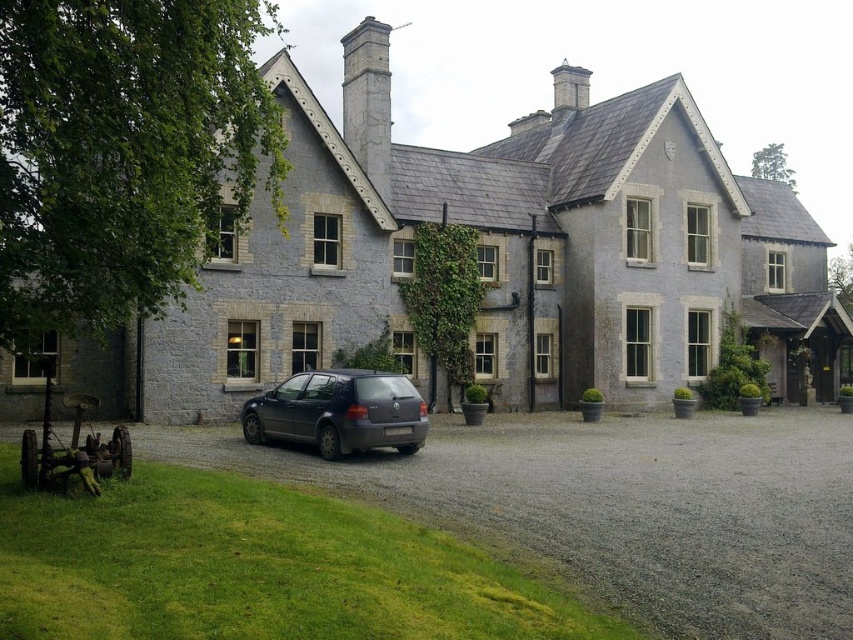
Does gray gravel driveway at lower center have a larger size compared to matte black car at center?

Yes.

Can you confirm if gray gravel driveway at lower center is shorter than matte black car at center?

Indeed, gray gravel driveway at lower center has a lesser height compared to matte black car at center.

Describe the element at coordinates (618, 506) in the screenshot. I see `gray gravel driveway at lower center` at that location.

Image resolution: width=853 pixels, height=640 pixels. Identify the location of gray gravel driveway at lower center. (618, 506).